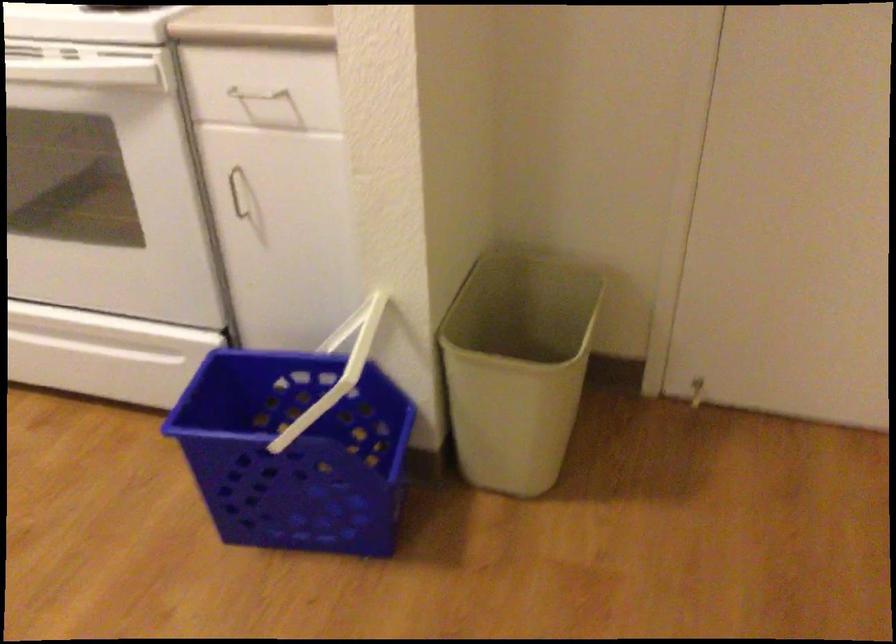
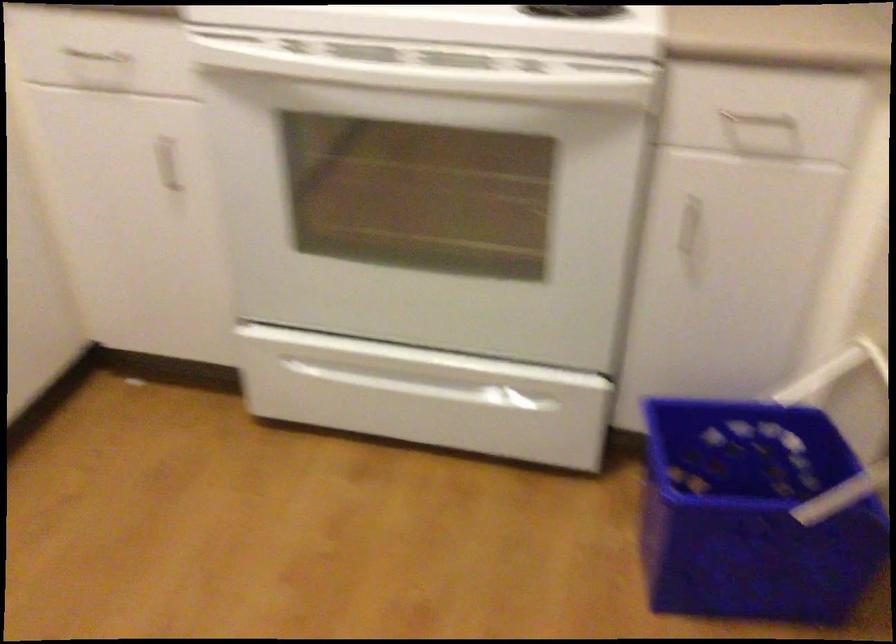
Find the pixel in the second image that matches (x=255, y=451) in the first image.

(752, 514)